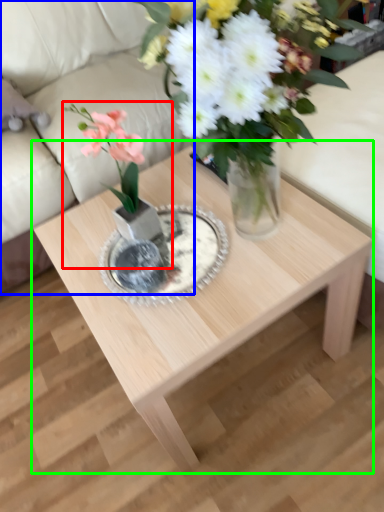
Question: Which object is the farthest from houseplant (highlighted by a red box)? Choose among these: couch (highlighted by a blue box) or coffee table (highlighted by a green box).

Choices:
 (A) couch
 (B) coffee table

Answer: (A)